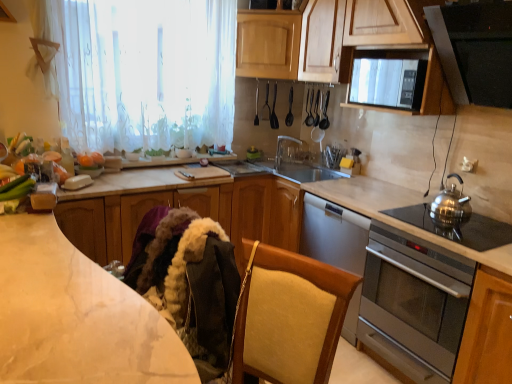
Question: Looking at the image, does metallic silver spoon at upper center, the 2th appliance from the right, seem bigger or smaller compared to white sheer curtain at upper left?

Choices:
 (A) small
 (B) big

Answer: (A)

Question: Relative to white sheer curtain at upper left, is metallic silver spoon at upper center, positioned as the 1th appliance in left-to-right order, in front or behind?

Choices:
 (A) front
 (B) behind

Answer: (B)

Question: Which object is the closest to the wooden cabinet at upper center, the second cabinetry when ordered from top to bottom?

Choices:
 (A) satin silver gas stove at right
 (B) green matte cucumber at lower left
 (C) wooden cabinet at upper center, which is the second cabinetry from bottom to top
 (D) clear plastic tap at center
 (E) white marble countertop at center, acting as the 1th countertop starting from the back

Answer: (C)

Question: Considering the real-world distances, which object is farthest from the metallic silver spoon at upper center, positioned as the 1th appliance in left-to-right order?

Choices:
 (A) orange matte pumpkin at upper left
 (B) white sheer curtain at upper left
 (C) clear plastic tap at center
 (D) wooden cabinet at upper center, the third cabinetry in the bottom-to-top sequence
 (E) velvet beige chair at lower center

Answer: (E)